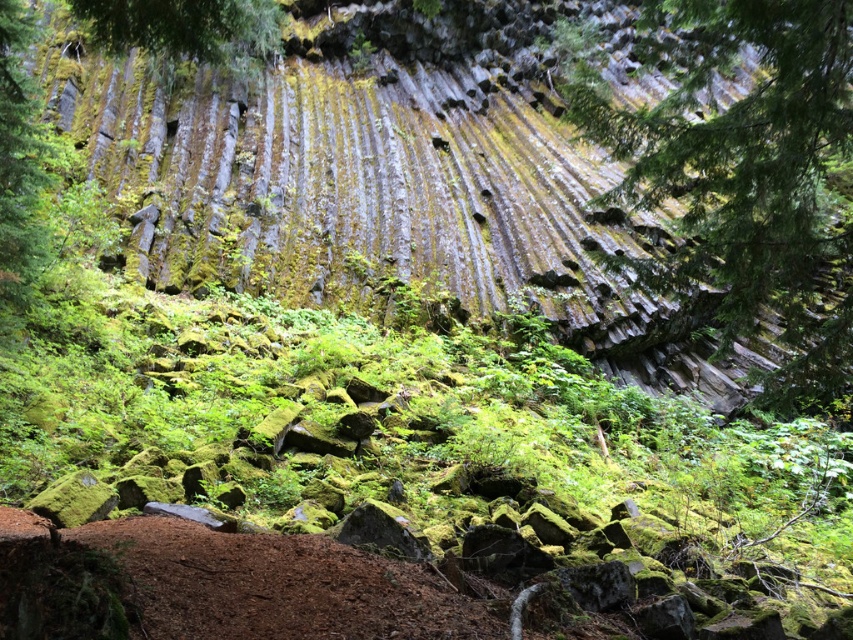
You are a geologist examining the image of the rock formation. You notice a point labeled at coordinates (747,176). Based on the scene description, what does this point indicate?

The point at (747,176) marks the location of the green mossy rock at upper right.

Based on the scene described, which object is taller between the green mossy rock at upper right and the green leafy tree at upper center?

The green mossy rock at upper right is much taller than the green leafy tree at upper center.

You are a hiker standing at the base of the rock formation. You notice the green mossy rock at upper right and the green leafy tree at upper center. Which object is nearer to you?

The green mossy rock at upper right is closer to the viewer than the green leafy tree at upper center.